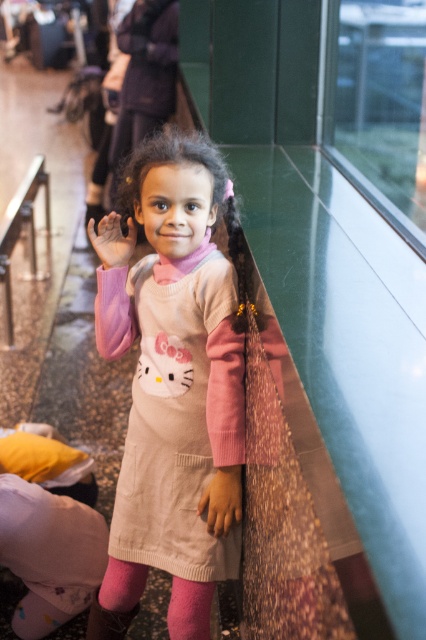
Is metallic rail at lower left to the left of smooth beige hand at center from the viewer's perspective?

Correct, you'll find metallic rail at lower left to the left of smooth beige hand at center.

Can you confirm if metallic rail at lower left is bigger than smooth beige hand at center?

Indeed, metallic rail at lower left has a larger size compared to smooth beige hand at center.

Which is in front, point (28, 212) or point (221, 513)?

Point (221, 513)

In order to click on metallic rail at lower left in this screenshot , I will do `click(20, 230)`.

Who is more forward, (x=143, y=260) or (x=129, y=221)?

Positioned in front is point (x=129, y=221).

Who is higher up, pink cotton dress at center or pink fabric hand at center?

pink fabric hand at center is above.

Locate an element on the screen. pink cotton dress at center is located at coordinates (172, 371).

Is pink cotton dress at center positioned behind smooth beige hand at center?

No.

Is pink cotton dress at center wider than smooth beige hand at center?

Yes, pink cotton dress at center is wider than smooth beige hand at center.

In order to click on pink cotton dress at center in this screenshot , I will do `click(172, 371)`.

You are a GUI agent. You are given a task and a screenshot of the screen. Output one action in this format:
    pyautogui.click(x=<x>, y=<y>)
    Task: Click on the pink cotton dress at center
    
    Given the screenshot: What is the action you would take?
    pyautogui.click(x=172, y=371)